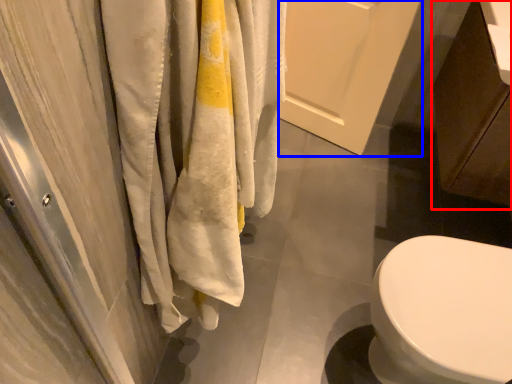
Question: Which object is further to the camera taking this photo, cabinetry (highlighted by a red box) or screen door (highlighted by a blue box)?

Choices:
 (A) cabinetry
 (B) screen door

Answer: (B)